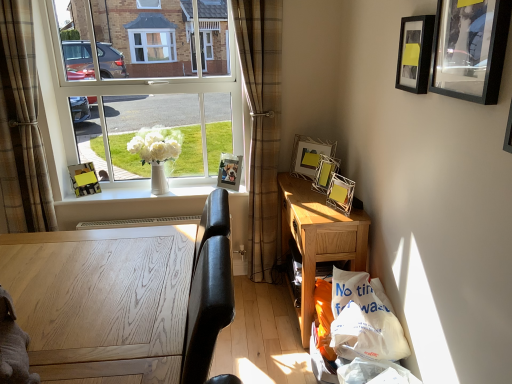
Question: From a real-world perspective, relative to white glossy vase at center, is metallic silver photo frame at upper center, which is the second picture frame from left to right, vertically above or below?

Choices:
 (A) below
 (B) above

Answer: (B)

Question: Is metallic silver photo frame at upper center, which is the second picture frame from left to right, inside the boundaries of white glossy vase at center, or outside?

Choices:
 (A) inside
 (B) outside

Answer: (B)

Question: Estimate the real-world distances between objects in this image. Which object is farther from the metallic silver photo frame at upper center, acting as the 5th picture frame starting from the right?

Choices:
 (A) white oak desk at lower left, the first desk viewed from the front
 (B) matte black picture frame at window, the 6th picture frame in the right-to-left sequence
 (C) white plastic bag at lower right
 (D) metallic silver picture frame at upper right, acting as the 1th picture frame starting from the right
 (E) yellow cardboard picture frame at upper right, arranged as the third picture frame when viewed from the right

Answer: (D)

Question: Which object is positioned closest to the clear glass window at upper left?

Choices:
 (A) matte black picture frame at window, the 1th picture frame in the left-to-right sequence
 (B) gray plush toy at lower left
 (C) metallic silver photo frame at upper center, acting as the 5th picture frame starting from the right
 (D) black matte picture frame at upper right, placed as the 5th picture frame when sorted from back to front
 (E) light oak desk at center, which is the 1th desk in back-to-front order

Answer: (A)